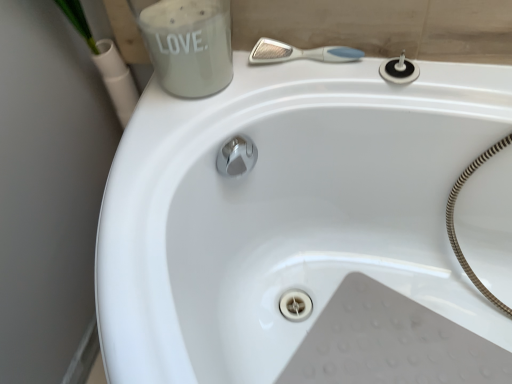
The width and height of the screenshot is (512, 384). Describe the element at coordinates (399, 70) in the screenshot. I see `black rubber drain at upper right` at that location.

The height and width of the screenshot is (384, 512). Describe the element at coordinates (300, 53) in the screenshot. I see `white plastic shower at upper center` at that location.

Where is `black rubber drain at upper right`? The image size is (512, 384). black rubber drain at upper right is located at coordinates click(399, 70).

From the image's perspective, between white frosted glass jar at upper left and black rubber drain at upper right, which one is located above?

white frosted glass jar at upper left, from the image's perspective.

What's the angular difference between white frosted glass jar at upper left and black rubber drain at upper right's facing directions?

The facing directions of white frosted glass jar at upper left and black rubber drain at upper right are 3.96 degrees apart.

Which object is thinner, white frosted glass jar at upper left or black rubber drain at upper right?

black rubber drain at upper right is thinner.

From a real-world perspective, is white frosted glass jar at upper left above or below black rubber drain at upper right?

From a real-world perspective, white frosted glass jar at upper left is physically above black rubber drain at upper right.

Which of these two, white plastic shower at upper center or black rubber drain at upper right, stands shorter?

white plastic shower at upper center.

Considering the sizes of white plastic shower at upper center and black rubber drain at upper right in the image, is white plastic shower at upper center bigger or smaller than black rubber drain at upper right?

In the image, white plastic shower at upper center appears to be larger than black rubber drain at upper right.

How different are the orientations of white plastic shower at upper center and black rubber drain at upper right in degrees?

The angle between the facing direction of white plastic shower at upper center and the facing direction of black rubber drain at upper right is 0.00156 degrees.

Do you think white plastic shower at upper center is within black rubber drain at upper right, or outside of it?

white plastic shower at upper center is not inside black rubber drain at upper right, it's outside.

How far apart are black rubber drain at upper right and white frosted glass jar at upper left?

black rubber drain at upper right is 13.80 inches away from white frosted glass jar at upper left.

Is black rubber drain at upper right directly adjacent to white frosted glass jar at upper left?

black rubber drain at upper right and white frosted glass jar at upper left are clearly separated.

Is point (400, 76) closer to viewer compared to point (189, 47)?

That is False.

Between black rubber drain at upper right and white frosted glass jar at upper left, which one has larger width?

With larger width is white frosted glass jar at upper left.

Is white frosted glass jar at upper left in front of or behind white plastic shower at upper center in the image?

white frosted glass jar at upper left is in front of white plastic shower at upper center.

Can you confirm if white frosted glass jar at upper left is wider than white plastic shower at upper center?

Correct, the width of white frosted glass jar at upper left exceeds that of white plastic shower at upper center.

Considering the relative sizes of white frosted glass jar at upper left and white plastic shower at upper center in the image provided, is white frosted glass jar at upper left shorter than white plastic shower at upper center?

No, white frosted glass jar at upper left is not shorter than white plastic shower at upper center.

From a real-world perspective, is white frosted glass jar at upper left physically located above or below white plastic shower at upper center?

From a real-world perspective, white frosted glass jar at upper left is physically above white plastic shower at upper center.

From the image's perspective, relative to white frosted glass jar at upper left, is white plastic shower at upper center above or below?

Based on their image positions, white plastic shower at upper center is located beneath white frosted glass jar at upper left.

Considering the positions of objects white plastic shower at upper center and white frosted glass jar at upper left in the image provided, who is more to the right, white plastic shower at upper center or white frosted glass jar at upper left?

From the viewer's perspective, white plastic shower at upper center appears more on the right side.

Do you think white plastic shower at upper center is within white frosted glass jar at upper left, or outside of it?

white plastic shower at upper center is not enclosed by white frosted glass jar at upper left.

From the image's perspective, is black rubber drain at upper right on white plastic shower at upper center?

No, from the image's perspective, black rubber drain at upper right is not above white plastic shower at upper center.

Is black rubber drain at upper right far from white plastic shower at upper center?

black rubber drain at upper right is near white plastic shower at upper center, not far away.

Considering the positions of objects black rubber drain at upper right and white plastic shower at upper center in the image provided, who is more to the left, black rubber drain at upper right or white plastic shower at upper center?

From the viewer's perspective, white plastic shower at upper center appears more on the left side.

Locate an element on the screen. The image size is (512, 384). plumbing fixture that is on the right side of white frosted glass jar at upper left is located at coordinates (399, 70).

At what (x,y) coordinates should I click in order to perform the action: click on plumbing fixture located below the white plastic shower at upper center (from the image's perspective). Please return your answer as a coordinate pair (x, y). Looking at the image, I should click on (399, 70).

When comparing their distances from black rubber drain at upper right, does white plastic shower at upper center or white frosted glass jar at upper left seem closer?

Among the two, white plastic shower at upper center is located nearer to black rubber drain at upper right.

Considering their positions, is white frosted glass jar at upper left positioned further to black rubber drain at upper right than white plastic shower at upper center?

white frosted glass jar at upper left.

Estimate the real-world distances between objects in this image. Which object is further from white plastic shower at upper center, white frosted glass jar at upper left or black rubber drain at upper right?

white frosted glass jar at upper left lies further to white plastic shower at upper center than the other object.

Considering their positions, is black rubber drain at upper right positioned closer to white frosted glass jar at upper left than white plastic shower at upper center?

white plastic shower at upper center is positioned closer to the anchor white frosted glass jar at upper left.

Which object lies nearer to the anchor point white frosted glass jar at upper left, white plastic shower at upper center or black rubber drain at upper right?

white plastic shower at upper center is closer to white frosted glass jar at upper left.

Estimate the real-world distances between objects in this image. Which object is closer to white plastic shower at upper center, black rubber drain at upper right or white frosted glass jar at upper left?

black rubber drain at upper right lies closer to white plastic shower at upper center than the other object.

The height and width of the screenshot is (384, 512). In order to click on shower between white frosted glass jar at upper left and black rubber drain at upper right in this screenshot , I will do `click(300, 53)`.